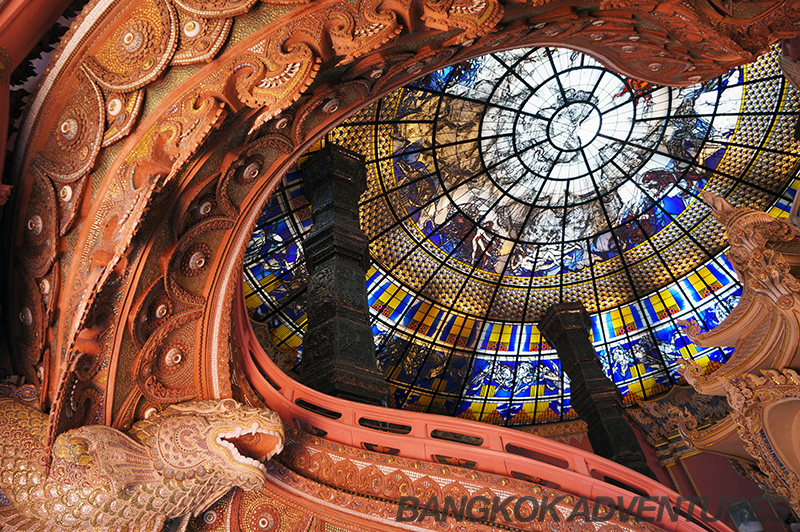
I want to click on decorative carving, so click(x=686, y=432), click(x=752, y=234), click(x=717, y=202).